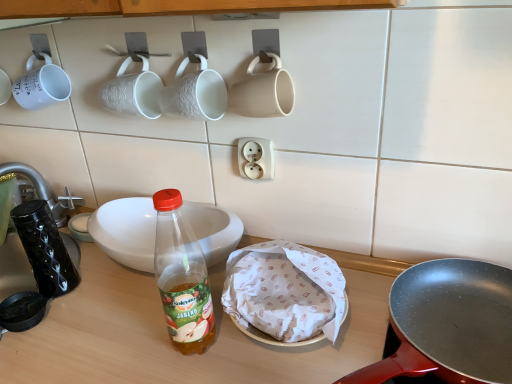
Question: Considering the positions of white textured mug at upper center, the second coffee cup positioned from the right, and white paper wrapped food at center in the image, is white textured mug at upper center, the second coffee cup positioned from the right, taller or shorter than white paper wrapped food at center?

Choices:
 (A) short
 (B) tall

Answer: (B)

Question: Based on their sizes in the image, would you say white textured mug at upper center, the second coffee cup positioned from the right, is bigger or smaller than white paper wrapped food at center?

Choices:
 (A) big
 (B) small

Answer: (A)

Question: Which of these objects is positioned closest to the matte black frying pan at center right?

Choices:
 (A) black glossy coffee cup at left
 (B) white textured mug at upper center, the 2th coffee cup in the left-to-right sequence
 (C) white paper wrapped food at center
 (D) matte white mug at upper center, the 1th coffee cup from the right
 (E) white ceramic bowl at center

Answer: (C)

Question: Which object is positioned farthest from the white paper wrapped food at center?

Choices:
 (A) translucent plastic bottle at center
 (B) translucent plastic bottle at center
 (C) white textured mug at upper center, the second coffee cup positioned from the right
 (D) white textured mug at upper center, the third coffee cup in the right-to-left sequence
 (E) black glossy coffee cup at left

Answer: (E)